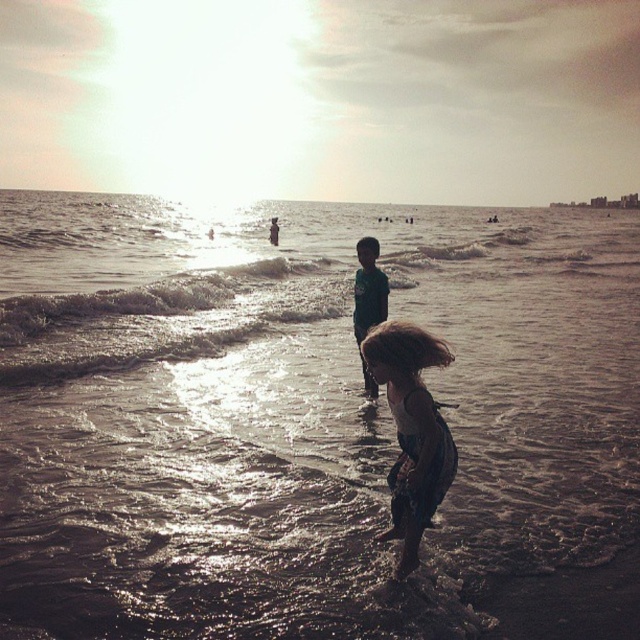
Who is positioned more to the right, shiny wet sand at center or green fabric shirt at center?

green fabric shirt at center is more to the right.

Is point (288, 380) positioned in front of point (362, 269)?

That is False.

Image resolution: width=640 pixels, height=640 pixels. Identify the location of shiny wet sand at center. (298, 413).

Which is behind, point (26, 307) or point (403, 449)?

The point (26, 307) is behind.

Where is `shiny wet sand at center`? The width and height of the screenshot is (640, 640). shiny wet sand at center is located at coordinates (298, 413).

From the picture: Who is lower down, dark hair at lower center or green fabric shirt at center?

dark hair at lower center

Who is more distant from viewer, (400, 422) or (364, 236)?

Positioned behind is point (364, 236).

Where is `dark hair at lower center`? dark hair at lower center is located at coordinates (412, 429).